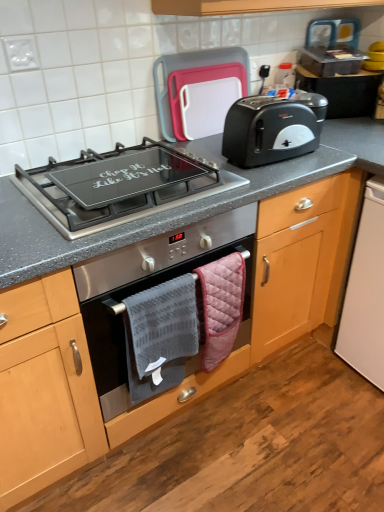
I want to click on empty space that is ontop of black glass cooktop at center, so click(x=119, y=175).